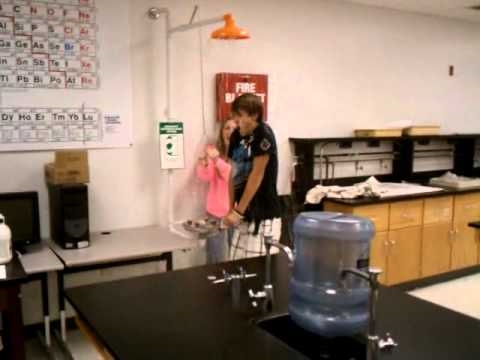
What are the coordinates of `wall` in the screenshot? It's located at (349, 62).